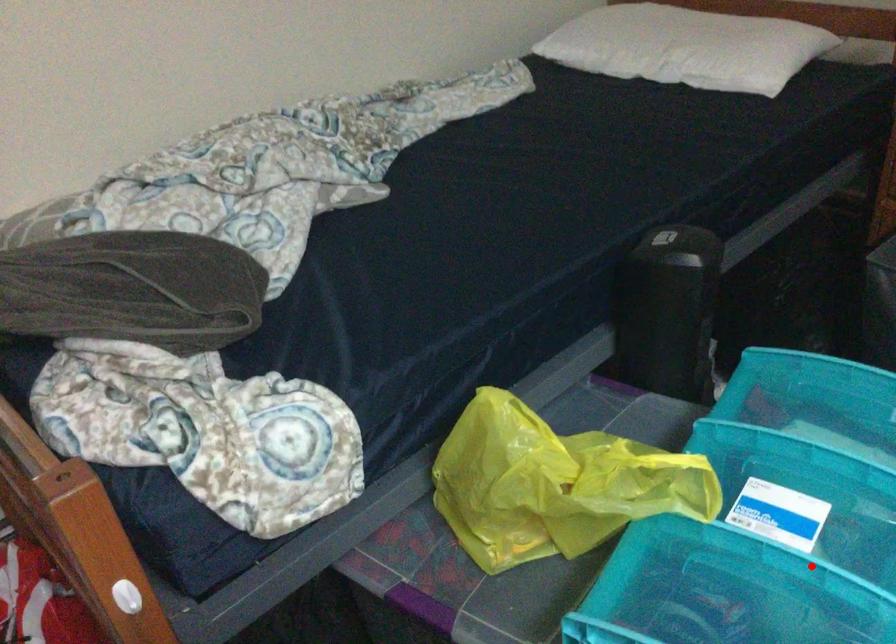
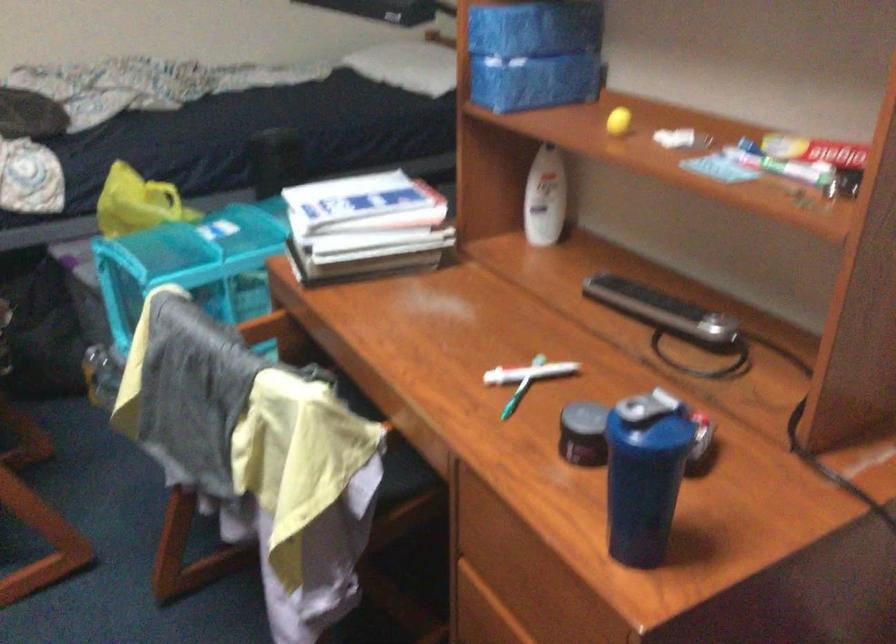
Where in the second image is the point corresponding to the highlighted location from the first image?

(205, 239)